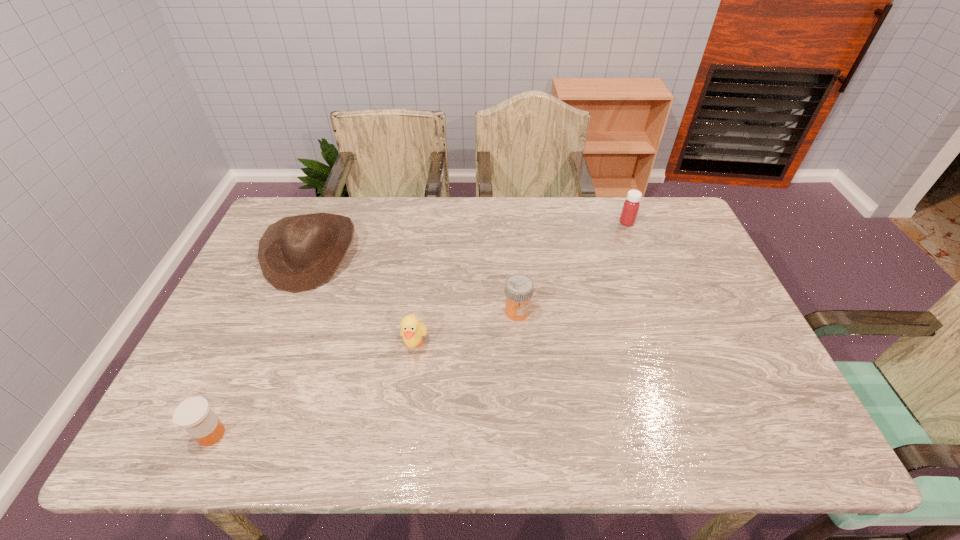
At what (x,y) coordinates should I click in order to perform the action: click on vacant space that is in between the duckling and the nearest medicine. Please return your answer as a coordinate pair (x, y). Looking at the image, I should click on (313, 389).

You are a GUI agent. You are given a task and a screenshot of the screen. Output one action in this format:
    pyautogui.click(x=<x>, y=<y>)
    Task: Click on the free spot between the third nearest object and the cowboy hat
    This screenshot has height=540, width=960.
    Given the screenshot: What is the action you would take?
    pyautogui.click(x=414, y=282)

Find the location of `vacant region between the duckling and the fourth object from left to right`. vacant region between the duckling and the fourth object from left to right is located at coordinates (466, 328).

Where is `free space that is in between the fourth object from left to right and the third object from right to left`? Image resolution: width=960 pixels, height=540 pixels. free space that is in between the fourth object from left to right and the third object from right to left is located at coordinates pyautogui.click(x=466, y=328).

Point out which object is positioned as the nearest to the rightmost medicine. Please provide its 2D coordinates. Your answer should be formatted as a tuple, i.e. [(x, y)], where the tuple contains the x and y coordinates of a point satisfying the conditions above.

[(518, 287)]

You are a GUI agent. You are given a task and a screenshot of the screen. Output one action in this format:
    pyautogui.click(x=<x>, y=<y>)
    Task: Click on the object that is the third nearest to the nearest medicine
    This screenshot has width=960, height=540.
    Given the screenshot: What is the action you would take?
    pyautogui.click(x=518, y=287)

Locate an element on the screen. Image resolution: width=960 pixels, height=540 pixels. medicine that can be found as the second closest to the second nearest medicine is located at coordinates (194, 414).

I want to click on medicine that is the second closest one to the third farthest object, so click(x=194, y=414).

Image resolution: width=960 pixels, height=540 pixels. In order to click on blank area in the image that satisfies the following two spatial constraints: 1. on the front-facing side of the second nearest object; 2. on the label of the leftmost medicine in this screenshot , I will do `click(402, 434)`.

Where is `vacant point that satisfies the following two spatial constraints: 1. on the label side of the fourth object from left to right; 2. on the label of the nearest medicine`? vacant point that satisfies the following two spatial constraints: 1. on the label side of the fourth object from left to right; 2. on the label of the nearest medicine is located at coordinates click(x=527, y=434).